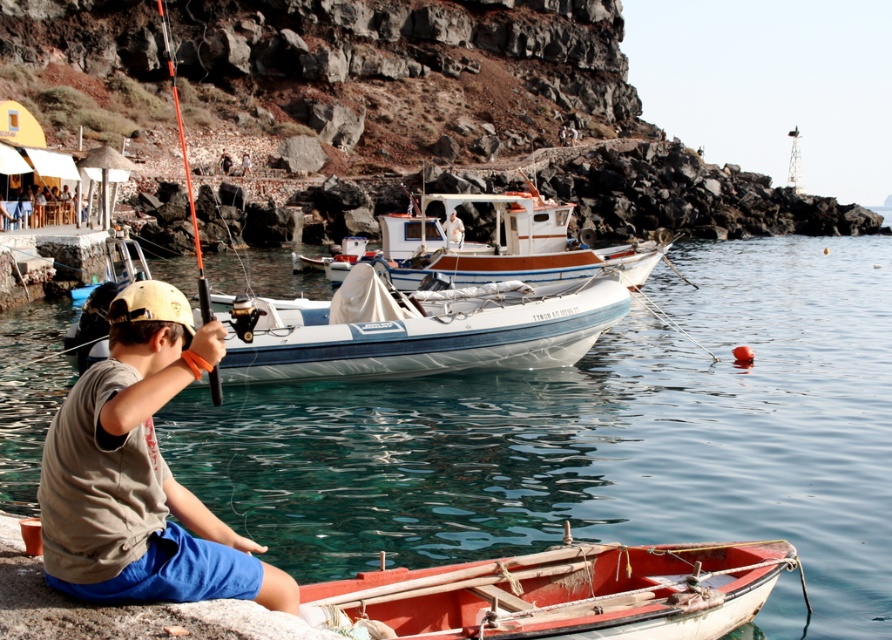
Question: Can you confirm if white wooden boat at center is positioned to the right of orange fiberglass fishing pole at left?

Choices:
 (A) yes
 (B) no

Answer: (A)

Question: Based on their relative distances, which object is farther from the clear blue water at lower center?

Choices:
 (A) white rubber boat at center
 (B) white wooden boat at center
 (C) orange fiberglass fishing pole at left
 (D) rustic wood boat at lower center

Answer: (C)

Question: Does clear blue water at lower center appear on the left side of khaki cotton cap at lower left?

Choices:
 (A) yes
 (B) no

Answer: (B)

Question: Which point is farther to the camera?

Choices:
 (A) white wooden boat at center
 (B) rustic wood boat at lower center
 (C) orange fiberglass fishing pole at left
 (D) clear blue water at lower center

Answer: (A)

Question: Among these objects, which one is nearest to the camera?

Choices:
 (A) rustic wood boat at lower center
 (B) white wooden boat at center
 (C) clear blue water at lower center

Answer: (A)

Question: Does white wooden boat at center appear over orange fiberglass fishing pole at left?

Choices:
 (A) yes
 (B) no

Answer: (B)